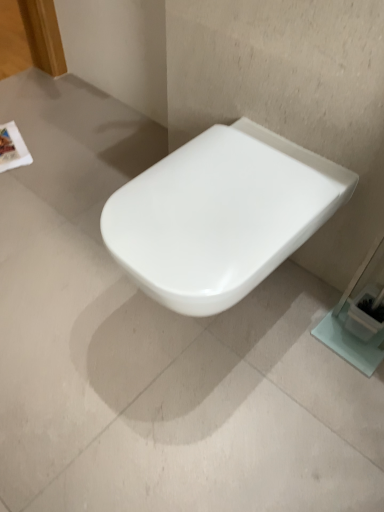
Question: Should I look upward or downward to see white glossy toilet at center?

Choices:
 (A) up
 (B) down

Answer: (A)